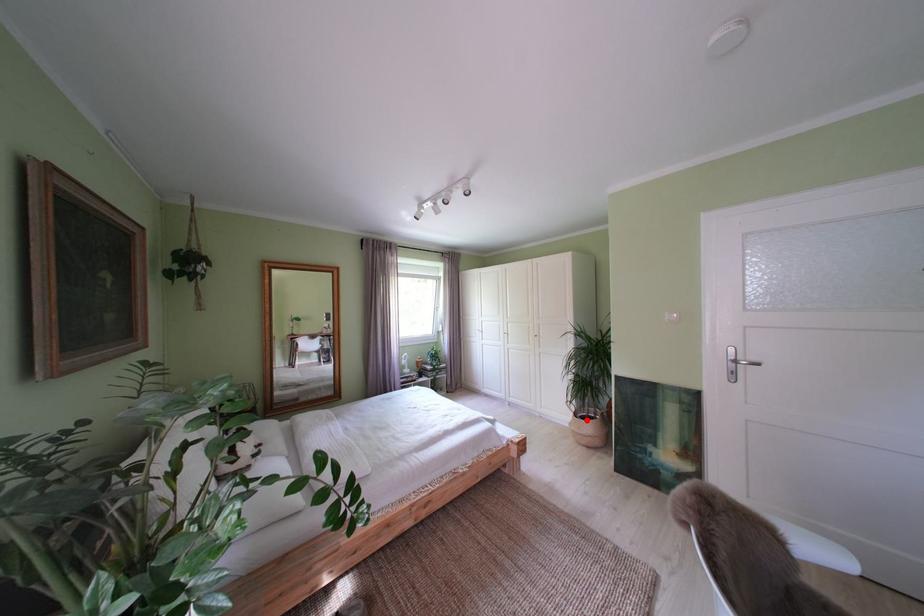
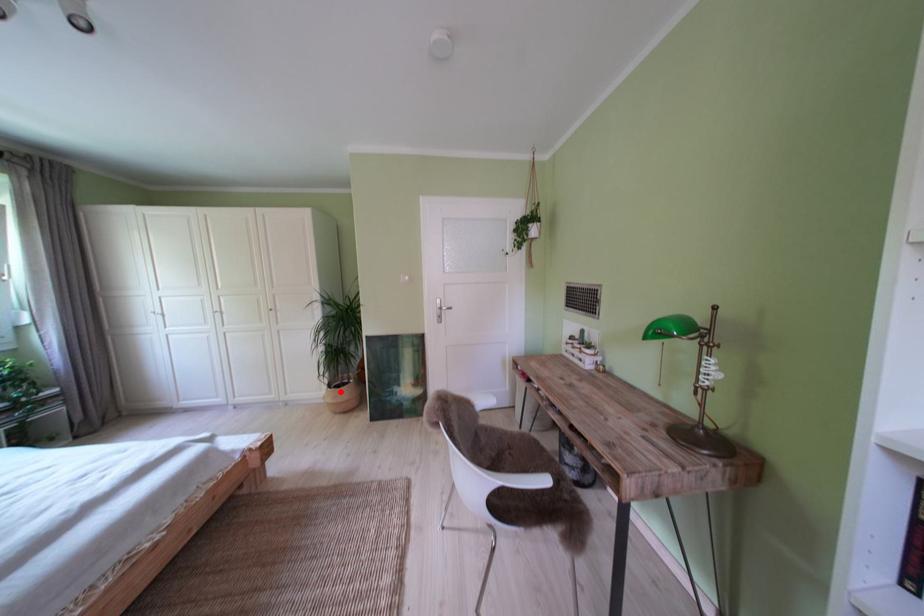
I am providing you with two images of the same scene from different viewpoints. A red point is marked on the first image and another point is marked on the second image. Are the points marked in image1 and image2 representing the same 3D position?

Yes